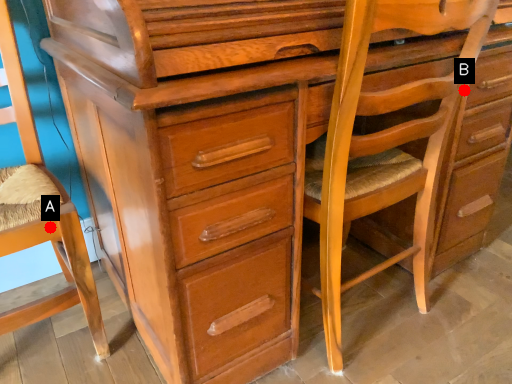
Question: Two points are circled on the image, labeled by A and B beside each circle. Which point is closer to the camera taking this photo?

Choices:
 (A) A is closer
 (B) B is closer

Answer: (A)